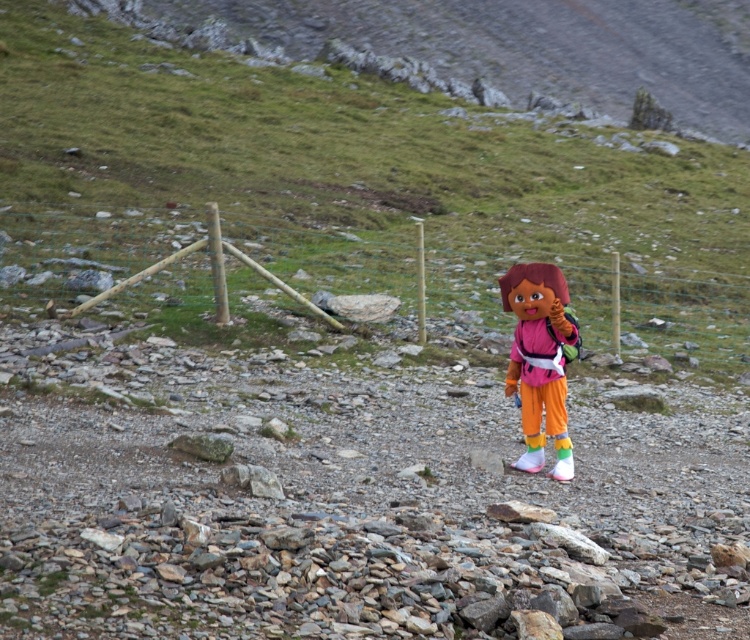
Between green grassy hillside at center and matte pink plush doll at center, which one has more height?

With more height is green grassy hillside at center.

Who is more distant from viewer, (322, 148) or (512, 387)?

The point (322, 148) is more distant.

The height and width of the screenshot is (640, 750). I want to click on green grassy hillside at center, so click(345, 150).